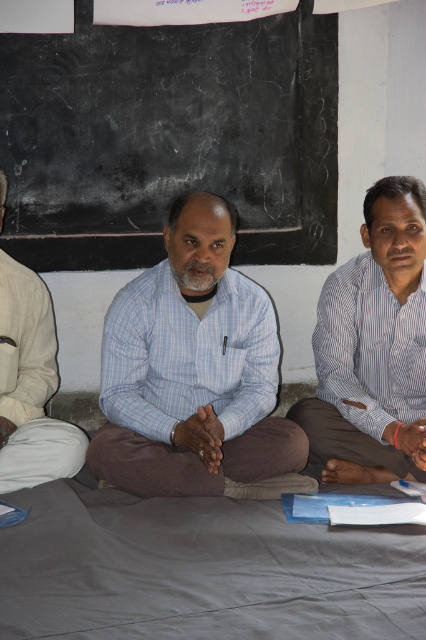
What do you see at coordinates (169, 138) in the screenshot?
I see `black chalkboard at upper center` at bounding box center [169, 138].

Who is more distant from viewer, (319, 17) or (48, 333)?

The point (319, 17) is more distant.

Find the location of a particular element. The image size is (426, 640). black chalkboard at upper center is located at coordinates (169, 138).

Is black chalkboard at upper center taller than blue checkered shirt at center?

Correct, black chalkboard at upper center is much taller as blue checkered shirt at center.

Based on the photo, is black chalkboard at upper center behind blue checkered shirt at center?

Yes.

Describe the element at coordinates (169, 138) in the screenshot. I see `black chalkboard at upper center` at that location.

Where is `black chalkboard at upper center`? The height and width of the screenshot is (640, 426). black chalkboard at upper center is located at coordinates (x=169, y=138).

Is black chalkboard at upper center further to camera compared to white striped shirt at right?

Yes, it is behind white striped shirt at right.

Does black chalkboard at upper center appear under white striped shirt at right?

Incorrect, black chalkboard at upper center is not positioned below white striped shirt at right.

The height and width of the screenshot is (640, 426). What do you see at coordinates (169, 138) in the screenshot?
I see `black chalkboard at upper center` at bounding box center [169, 138].

At what (x,y) coordinates should I click in order to perform the action: click on black chalkboard at upper center. Please return your answer as a coordinate pair (x, y). Image resolution: width=426 pixels, height=640 pixels. Looking at the image, I should click on (169, 138).